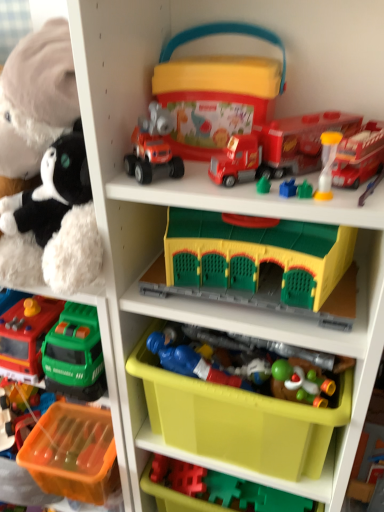
This screenshot has height=512, width=384. What do you see at coordinates (73, 453) in the screenshot? I see `translucent orange plastic container at left, positioned as the tenth toy in top-to-bottom order` at bounding box center [73, 453].

At what (x,y) coordinates should I click in order to perform the action: click on fluffy plush toy at left, arranged as the 10th toy when ordered from the bottom. Please return your answer as a coordinate pair (x, y). The width and height of the screenshot is (384, 512). Looking at the image, I should click on (36, 98).

What are the coordinates of `translucent orange plastic container at left, which is the first toy in bottom-to-top order` in the screenshot? It's located at (73, 453).

From the image's perspective, who appears lower, yellow plastic storage box at center, which is the 2th storage box in top-to-bottom order, or blue plastic toy soldier at center, which is counted as the fourth toy, starting from the bottom?

yellow plastic storage box at center, which is the 2th storage box in top-to-bottom order, appears lower in the image.

Is point (308, 459) behind point (171, 364)?

Yes, point (308, 459) is behind point (171, 364).

Looking at this image, from a real-world perspective, is yellow plastic storage box at center, acting as the 2th storage box starting from the bottom, positioned over blue plastic toy soldier at center, which is counted as the fourth toy, starting from the bottom, based on gravity?

No, from a real-world perspective, yellow plastic storage box at center, acting as the 2th storage box starting from the bottom, is not over blue plastic toy soldier at center, which is counted as the fourth toy, starting from the bottom

Is yellow plastic storage box at center, acting as the 2th storage box starting from the bottom, smaller than blue plastic toy soldier at center, which is counted as the fourth toy, starting from the bottom?

Incorrect, yellow plastic storage box at center, acting as the 2th storage box starting from the bottom, is not smaller in size than blue plastic toy soldier at center, which is counted as the fourth toy, starting from the bottom.

Looking at this image, is translucent orange plastic tray at lower left, which appears as the 2th toy when ordered from the bottom, situated inside blue plastic toy soldier at center, the 7th toy in the top-to-bottom sequence, or outside?

translucent orange plastic tray at lower left, which appears as the 2th toy when ordered from the bottom, is not enclosed by blue plastic toy soldier at center, the 7th toy in the top-to-bottom sequence.

Could you tell me if translucent orange plastic tray at lower left, acting as the ninth toy starting from the top, is facing blue plastic toy soldier at center, the 7th toy in the top-to-bottom sequence?

No, translucent orange plastic tray at lower left, acting as the ninth toy starting from the top, does not turn towards blue plastic toy soldier at center, the 7th toy in the top-to-bottom sequence.

From the image's perspective, is translucent orange plastic tray at lower left, acting as the ninth toy starting from the top, positioned above or below blue plastic toy soldier at center, the 7th toy in the top-to-bottom sequence?

translucent orange plastic tray at lower left, acting as the ninth toy starting from the top, is situated lower than blue plastic toy soldier at center, the 7th toy in the top-to-bottom sequence, in the image.

Considering the relative sizes of translucent orange plastic tray at lower left, acting as the ninth toy starting from the top, and blue plastic toy soldier at center, the 7th toy in the top-to-bottom sequence, in the image provided, is translucent orange plastic tray at lower left, acting as the ninth toy starting from the top, bigger than blue plastic toy soldier at center, the 7th toy in the top-to-bottom sequence,?

Yes, translucent orange plastic tray at lower left, acting as the ninth toy starting from the top, is bigger than blue plastic toy soldier at center, the 7th toy in the top-to-bottom sequence.

Considering the positions of objects yellow plastic building at center, the 6th toy positioned from the top, and translucent orange plastic container at left, positioned as the tenth toy in top-to-bottom order, in the image provided, who is behind, yellow plastic building at center, the 6th toy positioned from the top, or translucent orange plastic container at left, positioned as the tenth toy in top-to-bottom order,?

translucent orange plastic container at left, positioned as the tenth toy in top-to-bottom order, is more distant.

In the image, is yellow plastic building at center, the 5th toy when ordered from bottom to top, on the left side or the right side of translucent orange plastic container at left, which is the first toy in bottom-to-top order?

yellow plastic building at center, the 5th toy when ordered from bottom to top, is to the right of translucent orange plastic container at left, which is the first toy in bottom-to-top order.

Looking at their sizes, would you say yellow plastic building at center, the 6th toy positioned from the top, is wider or thinner than translucent orange plastic container at left, which is the first toy in bottom-to-top order?

Clearly, yellow plastic building at center, the 6th toy positioned from the top, has less width compared to translucent orange plastic container at left, which is the first toy in bottom-to-top order.

There is a yellow plastic building at center, the 6th toy positioned from the top. Identify the location of the 4th toy below it (from the image's perspective). (73, 453).

Between yellow plastic storage box at center, acting as the 2th storage box starting from the bottom, and green matte yoshi at lower center, the 3th toy ordered from the bottom, which one has less height?

green matte yoshi at lower center, the 3th toy ordered from the bottom, is shorter.

From the picture: Is there a large distance between yellow plastic storage box at center, acting as the 2th storage box starting from the bottom, and green matte yoshi at lower center, the 3th toy ordered from the bottom?

Actually, yellow plastic storage box at center, acting as the 2th storage box starting from the bottom, and green matte yoshi at lower center, the 3th toy ordered from the bottom, are a little close together.

Could you tell me if yellow plastic storage box at center, which is the 2th storage box in top-to-bottom order, is turned towards green matte yoshi at lower center, the 3th toy ordered from the bottom?

Yes.

From the picture: Between blue plastic toy soldier at center, which is counted as the fourth toy, starting from the bottom, and translucent yellow hourglass at upper right, which is the fourth toy from top to bottom, which one appears on the right side from the viewer's perspective?

From the viewer's perspective, translucent yellow hourglass at upper right, which is the fourth toy from top to bottom, appears more on the right side.

Which object is closer to the camera taking this photo, blue plastic toy soldier at center, which is counted as the fourth toy, starting from the bottom, or translucent yellow hourglass at upper right, which is the fourth toy from top to bottom?

translucent yellow hourglass at upper right, which is the fourth toy from top to bottom, is closer to the camera.

From the image's perspective, who appears lower, blue plastic toy soldier at center, which is counted as the fourth toy, starting from the bottom, or translucent yellow hourglass at upper right, which is counted as the 7th toy, starting from the bottom?

blue plastic toy soldier at center, which is counted as the fourth toy, starting from the bottom.

Is blue plastic toy soldier at center, which is counted as the fourth toy, starting from the bottom, positioned beyond the bounds of translucent yellow hourglass at upper right, which is the fourth toy from top to bottom?

Yes, blue plastic toy soldier at center, which is counted as the fourth toy, starting from the bottom, is not within translucent yellow hourglass at upper right, which is the fourth toy from top to bottom.

Starting from the translucent orange plastic tray at lower left, acting as the ninth toy starting from the top, which toy is the 4th one in front? Please provide its 2D coordinates.

[(258, 266)]

From a real-world perspective, is translucent orange plastic tray at lower left, acting as the ninth toy starting from the top, located beneath yellow plastic building at center, the 6th toy positioned from the top?

Yes, from a real-world perspective, translucent orange plastic tray at lower left, acting as the ninth toy starting from the top, is beneath yellow plastic building at center, the 6th toy positioned from the top.

Would you say translucent orange plastic tray at lower left, acting as the ninth toy starting from the top, is outside yellow plastic building at center, the 6th toy positioned from the top?

Yes, translucent orange plastic tray at lower left, acting as the ninth toy starting from the top, is outside of yellow plastic building at center, the 6th toy positioned from the top.

How far apart are translucent orange plastic tray at lower left, acting as the ninth toy starting from the top, and yellow plastic building at center, the 6th toy positioned from the top?

translucent orange plastic tray at lower left, acting as the ninth toy starting from the top, is 26.80 inches away from yellow plastic building at center, the 6th toy positioned from the top.

How many degrees apart are the facing directions of fluffy plush toy at left, marked as the first toy in a top-to-bottom arrangement, and green matte yoshi at lower center, which is counted as the eighth toy, starting from the top?

0.194 degrees.

Considering the sizes of objects fluffy plush toy at left, arranged as the 10th toy when ordered from the bottom, and green matte yoshi at lower center, which is counted as the eighth toy, starting from the top, in the image provided, who is wider, fluffy plush toy at left, arranged as the 10th toy when ordered from the bottom, or green matte yoshi at lower center, which is counted as the eighth toy, starting from the top,?

fluffy plush toy at left, arranged as the 10th toy when ordered from the bottom, is wider.

From a real-world perspective, is fluffy plush toy at left, marked as the first toy in a top-to-bottom arrangement, positioned over green matte yoshi at lower center, the 3th toy ordered from the bottom, based on gravity?

Yes, from a real-world perspective, fluffy plush toy at left, marked as the first toy in a top-to-bottom arrangement, is over green matte yoshi at lower center, the 3th toy ordered from the bottom

Does fluffy plush toy at left, marked as the first toy in a top-to-bottom arrangement, come behind green matte yoshi at lower center, the 3th toy ordered from the bottom?

No, it is not.

I want to click on the 2nd toy directly above the yellow plastic storage box at center, acting as the 2th storage box starting from the bottom (from a real-world perspective), so click(190, 362).

You are a GUI agent. You are given a task and a screenshot of the screen. Output one action in this format:
    pyautogui.click(x=<x>, y=<y>)
    Task: Click on the 2nd toy above the translucent orange plastic tray at lower left, acting as the ninth toy starting from the top (from the image's perspective)
    The image size is (384, 512).
    Given the screenshot: What is the action you would take?
    pyautogui.click(x=190, y=362)

Considering their positions, is translucent orange plastic container at left, which is the first toy in bottom-to-top order, positioned closer to yellow plastic building at center, the 6th toy positioned from the top, than translucent orange plastic tray at lower left, which appears as the 2th toy when ordered from the bottom?

translucent orange plastic container at left, which is the first toy in bottom-to-top order, lies closer to yellow plastic building at center, the 6th toy positioned from the top, than the other object.

Estimate the real-world distances between objects in this image. Which object is further from yellow plastic storage box at center, acting as the 2th storage box starting from the bottom, orange plastic storage box at lower left, placed as the third storage box when sorted from top to bottom, or translucent orange plastic tray at lower left, which appears as the 2th toy when ordered from the bottom?

Based on the image, translucent orange plastic tray at lower left, which appears as the 2th toy when ordered from the bottom, appears to be further to yellow plastic storage box at center, acting as the 2th storage box starting from the bottom.

When comparing their distances from matte plastic storage box at upper center, positioned as the first storage box in top-to-bottom order, does translucent orange plastic tray at lower left, acting as the ninth toy starting from the top, or translucent yellow hourglass at upper right, the 6th toy in the bottom-to-top sequence, seem further?

translucent orange plastic tray at lower left, acting as the ninth toy starting from the top, is positioned further to the anchor matte plastic storage box at upper center, positioned as the first storage box in top-to-bottom order.

Which object lies further to the anchor point translucent yellow hourglass at upper right, which appears as the 5th toy when viewed from the top, orange plastic storage box at lower left, which is the first storage box from bottom to top, or rubberized red truck at center, which is counted as the eighth toy, starting from the bottom?

orange plastic storage box at lower left, which is the first storage box from bottom to top.

From the picture: From the image, which object appears to be nearer to blue plastic toy soldier at center, the 7th toy in the top-to-bottom sequence, translucent orange plastic tray at lower left, acting as the ninth toy starting from the top, or matte plastic storage box at upper center, the third storage box positioned from the bottom?

matte plastic storage box at upper center, the third storage box positioned from the bottom, lies closer to blue plastic toy soldier at center, the 7th toy in the top-to-bottom sequence, than the other object.

Considering their positions, is matte plastic storage box at upper center, positioned as the first storage box in top-to-bottom order, positioned closer to fluffy plush toy at left, arranged as the 10th toy when ordered from the bottom, than translucent orange plastic container at left, which is the first toy in bottom-to-top order?

Based on the image, matte plastic storage box at upper center, positioned as the first storage box in top-to-bottom order, appears to be nearer to fluffy plush toy at left, arranged as the 10th toy when ordered from the bottom.

Looking at the image, which one is located further to rubberized red truck at upper center, the ninth toy from the bottom, matte plastic storage box at upper center, the third storage box positioned from the bottom, or green matte yoshi at lower center, which is counted as the eighth toy, starting from the top?

green matte yoshi at lower center, which is counted as the eighth toy, starting from the top, lies further to rubberized red truck at upper center, the ninth toy from the bottom, than the other object.

Estimate the real-world distances between objects in this image. Which object is closer to orange plastic storage box at lower left, placed as the third storage box when sorted from top to bottom, blue plastic toy soldier at center, which is counted as the fourth toy, starting from the bottom, or matte plastic storage box at upper center, the third storage box positioned from the bottom?

blue plastic toy soldier at center, which is counted as the fourth toy, starting from the bottom, lies closer to orange plastic storage box at lower left, placed as the third storage box when sorted from top to bottom, than the other object.

In order to click on storage box that lies between matte plastic storage box at upper center, the third storage box positioned from the bottom, and translucent orange plastic container at left, which is the first toy in bottom-to-top order, from top to bottom in this screenshot , I will do `click(238, 420)`.

Locate an element on the screen. Image resolution: width=384 pixels, height=512 pixels. storage box between matte plastic storage box at upper center, positioned as the first storage box in top-to-bottom order, and translucent orange plastic tray at lower left, acting as the ninth toy starting from the top, from top to bottom is located at coordinates (238, 420).

Where is `storage box that lies between matte plastic storage box at upper center, the third storage box positioned from the bottom, and orange plastic storage box at lower left, which is the first storage box from bottom to top, from top to bottom`? The height and width of the screenshot is (512, 384). storage box that lies between matte plastic storage box at upper center, the third storage box positioned from the bottom, and orange plastic storage box at lower left, which is the first storage box from bottom to top, from top to bottom is located at coordinates (238, 420).

Identify the location of toy located between translucent orange plastic container at left, which is the first toy in bottom-to-top order, and orange plastic storage box at lower left, which is the first storage box from bottom to top, in the left-right direction. Image resolution: width=384 pixels, height=512 pixels. (20, 413).